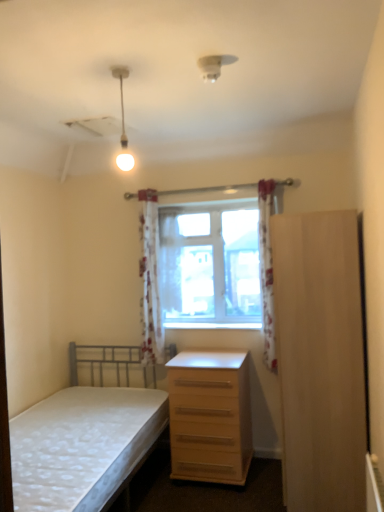
Question: From a real-world perspective, is wooden at center below white floral fabric curtain at center, which is the 1th curtain in back-to-front order?

Choices:
 (A) yes
 (B) no

Answer: (A)

Question: Is the position of wooden at center more distant than that of white floral fabric curtain at center, marked as the 3th curtain in a front-to-back arrangement?

Choices:
 (A) no
 (B) yes

Answer: (A)

Question: Is wooden at center not near white floral fabric curtain at center, which ranks as the second curtain in right-to-left order?

Choices:
 (A) no
 (B) yes

Answer: (A)

Question: Considering the relative sizes of wooden at center and white floral fabric curtain at center, which ranks as the second curtain in right-to-left order, in the image provided, is wooden at center thinner than white floral fabric curtain at center, which ranks as the second curtain in right-to-left order,?

Choices:
 (A) no
 (B) yes

Answer: (A)

Question: From the image's perspective, is wooden at center below white floral fabric curtain at center, placed as the second curtain when sorted from left to right?

Choices:
 (A) no
 (B) yes

Answer: (B)

Question: Does point pos(178,380) appear closer or farther from the camera than point pos(130,168)?

Choices:
 (A) closer
 (B) farther

Answer: (A)

Question: Considering their positions, is light wood/wooden chest of drawers at lower right located in front of or behind matte white bulb at upper center?

Choices:
 (A) front
 (B) behind

Answer: (B)

Question: From a real-world perspective, relative to matte white bulb at upper center, is light wood/wooden chest of drawers at lower right vertically above or below?

Choices:
 (A) above
 (B) below

Answer: (B)

Question: Considering the positions of light wood/wooden chest of drawers at lower right and matte white bulb at upper center in the image, is light wood/wooden chest of drawers at lower right taller or shorter than matte white bulb at upper center?

Choices:
 (A) tall
 (B) short

Answer: (A)

Question: In terms of height, does white floral fabric curtain at center, which ranks as the second curtain in right-to-left order, look taller or shorter compared to light wood/wooden chest of drawers at lower right?

Choices:
 (A) tall
 (B) short

Answer: (A)

Question: Which is correct: white floral fabric curtain at center, which ranks as the second curtain in right-to-left order, is inside light wood/wooden chest of drawers at lower right, or outside of it?

Choices:
 (A) inside
 (B) outside

Answer: (B)

Question: Considering the positions of point (160, 293) and point (193, 464), is point (160, 293) closer or farther from the camera than point (193, 464)?

Choices:
 (A) closer
 (B) farther

Answer: (B)

Question: Considering the positions of white floral fabric curtain at center, placed as the second curtain when sorted from left to right, and light wood/wooden chest of drawers at lower right in the image, is white floral fabric curtain at center, placed as the second curtain when sorted from left to right, wider or thinner than light wood/wooden chest of drawers at lower right?

Choices:
 (A) thin
 (B) wide

Answer: (A)

Question: In terms of width, does light wood/file cabinet at right look wider or thinner when compared to white floral fabric curtain at center, which is the 1th curtain in back-to-front order?

Choices:
 (A) thin
 (B) wide

Answer: (B)

Question: Would you say light wood/file cabinet at right is inside or outside white floral fabric curtain at center, which ranks as the second curtain in right-to-left order?

Choices:
 (A) outside
 (B) inside

Answer: (A)